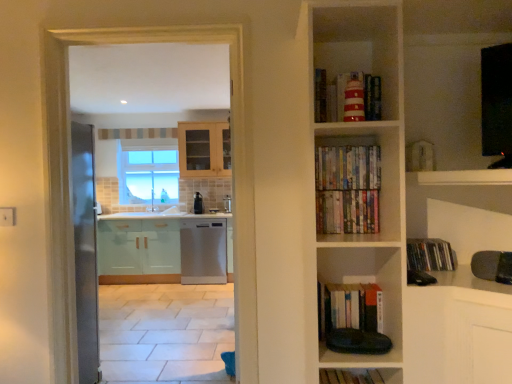
Question: In the image, is hardcover books at center, the fifth book in the top-to-bottom sequence, positioned in front of or behind multicolored paperbacks at center, marked as the 5th book in a bottom-to-top arrangement?

Choices:
 (A) front
 (B) behind

Answer: (A)

Question: Considering the positions of hardcover books at center, which is the second book from bottom to top, and multicolored paperbacks at center, the second book in the top-to-bottom sequence, in the image, is hardcover books at center, which is the second book from bottom to top, wider or thinner than multicolored paperbacks at center, the second book in the top-to-bottom sequence,?

Choices:
 (A) thin
 (B) wide

Answer: (B)

Question: Based on their relative distances, which object is nearer to the striped paper lighthouse at upper center, the first book when ordered from top to bottom?

Choices:
 (A) matte black book at lower right, which is counted as the third book, starting from the bottom
 (B) multicolored paperbacks at center, the second book in the top-to-bottom sequence
 (C) wooden book at lower center, which ranks as the first book in bottom-to-top order
 (D) multicolored paperbacks at center, the third book when ordered from top to bottom
 (E) satin white dishwasher at center

Answer: (B)

Question: Which object is the farthest from the multicolored paperbacks at center, the third book when ordered from top to bottom?

Choices:
 (A) satin white dishwasher at center
 (B) matte black book at lower right, the fourth book positioned from the top
 (C) wooden book at lower center, which ranks as the first book in bottom-to-top order
 (D) hardcover books at center, the fifth book in the top-to-bottom sequence
 (E) multicolored paperbacks at center, marked as the 5th book in a bottom-to-top arrangement

Answer: (A)